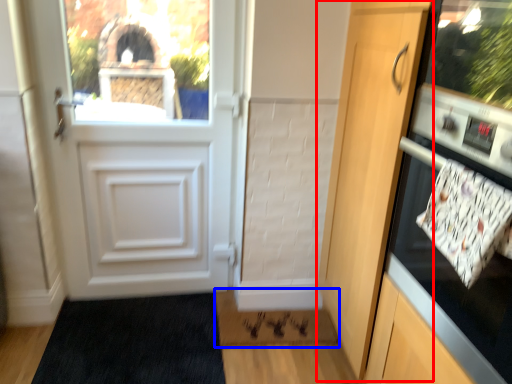
Question: Among these objects, which one is nearest to the camera, door (highlighted by a red box) or doormat (highlighted by a blue box)?

Choices:
 (A) door
 (B) doormat

Answer: (A)